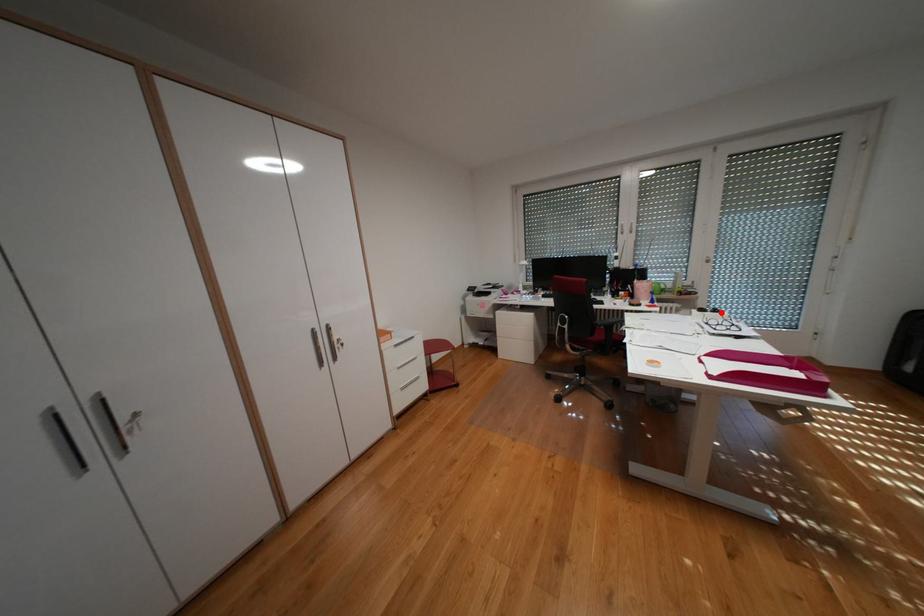
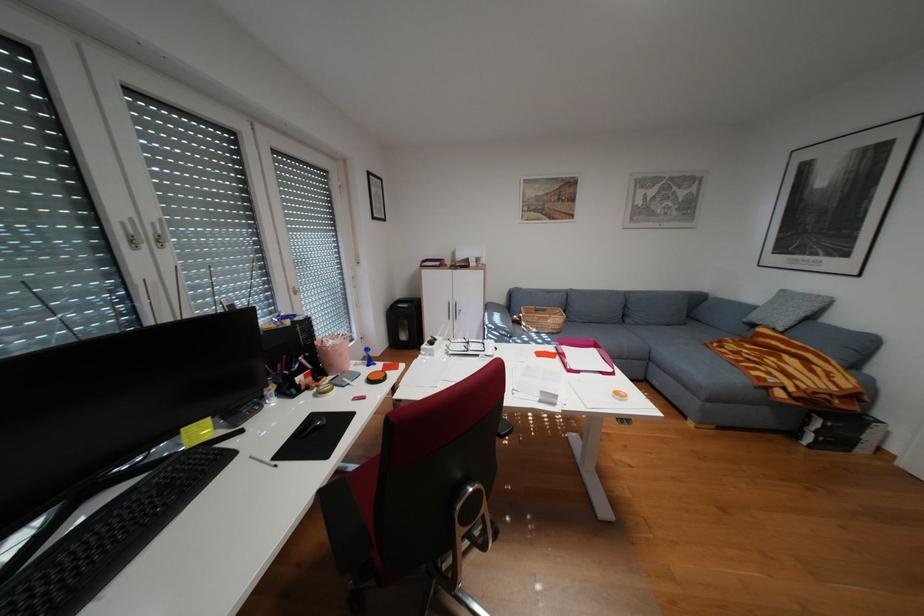
Locate, in the second image, the point that corresponds to the highlighted location in the first image.

(448, 342)